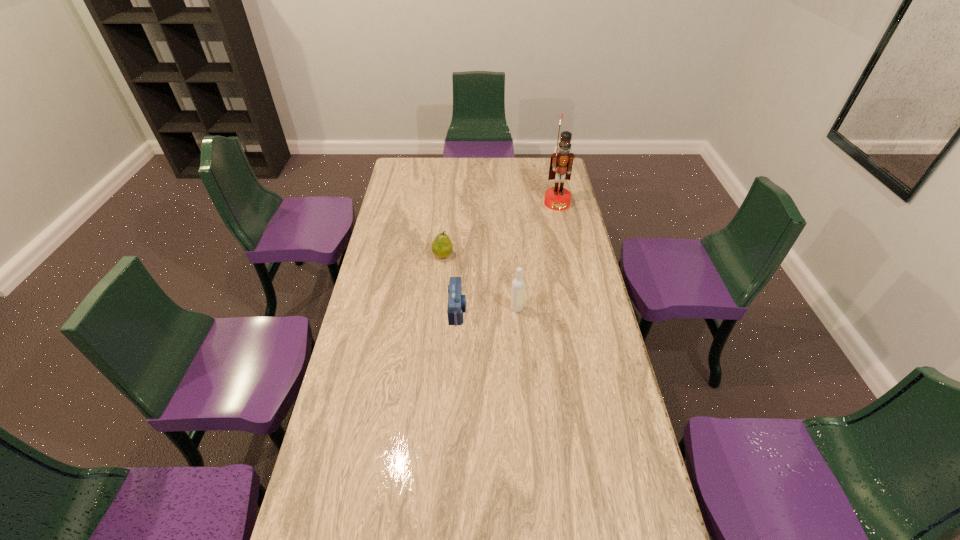
Locate an element on the screen. The width and height of the screenshot is (960, 540). vacant point located between the farthest object and the camera is located at coordinates (507, 256).

Locate an element on the screen. The image size is (960, 540). vacant area between the camera and the second object from right to left is located at coordinates (487, 309).

Identify the location of vacant space that is in between the tallest object and the third shortest object. click(537, 256).

Locate an element on the screen. The width and height of the screenshot is (960, 540). free area in between the third nearest object and the vodka is located at coordinates (480, 282).

I want to click on free point between the second farthest object and the third object from left to right, so click(480, 282).

Locate an element on the screen. unoccupied area between the vodka and the tallest object is located at coordinates (537, 256).

Where is `object that is the second closest one to the farthest object`? The height and width of the screenshot is (540, 960). object that is the second closest one to the farthest object is located at coordinates (518, 284).

This screenshot has width=960, height=540. Identify the location of the second closest object to the third nearest object. (518, 284).

Where is `vacant region that satisfies the following two spatial constraints: 1. on the front side of the vodka; 2. on the lens of the shortest object`? This screenshot has width=960, height=540. vacant region that satisfies the following two spatial constraints: 1. on the front side of the vodka; 2. on the lens of the shortest object is located at coordinates (516, 310).

Find the location of `vacant region that satisfies the following two spatial constraints: 1. on the front-facing side of the farthest object; 2. on the lens of the camera`. vacant region that satisfies the following two spatial constraints: 1. on the front-facing side of the farthest object; 2. on the lens of the camera is located at coordinates (580, 310).